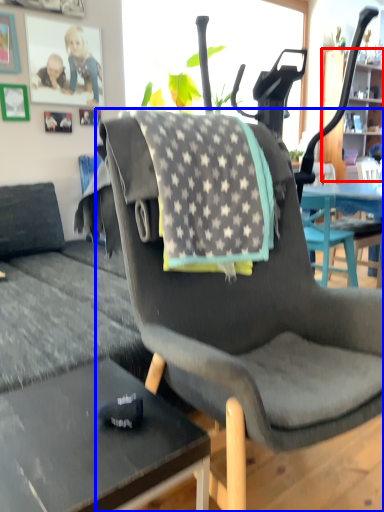
Question: Which object is further to the camera taking this photo, cabinetry (highlighted by a red box) or chair (highlighted by a blue box)?

Choices:
 (A) cabinetry
 (B) chair

Answer: (A)